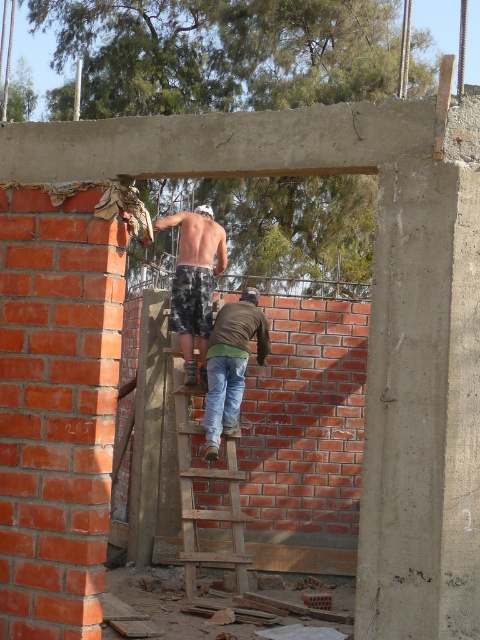
From the picture: You are standing at the construction site and see both the camo shorts at center and the jeans at center. Which piece of clothing is closer to you?

The camo shorts at center is closer to you because it is further to the viewer than the jeans at center.

You are a construction worker standing at the center of the image. You need to choose between wearing camo shorts at center and jeans at center for the job. Which one is more appropriate based on their sizes?

The camo shorts at center is bigger than jeans at center, so it would be more appropriate to wear the camo shorts at center for the job as it provides better coverage and comfort during physical work.